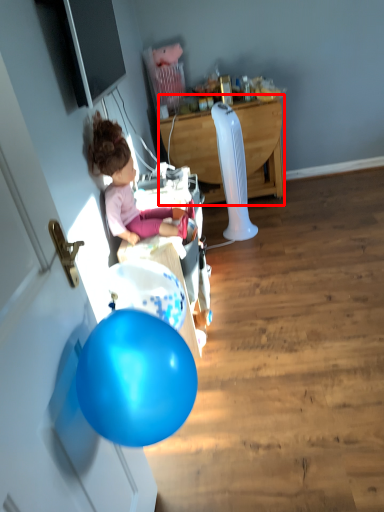
Question: From the image, what is the correct spatial relationship of desk (annotated by the red box) in relation to person?

Choices:
 (A) left
 (B) right

Answer: (B)